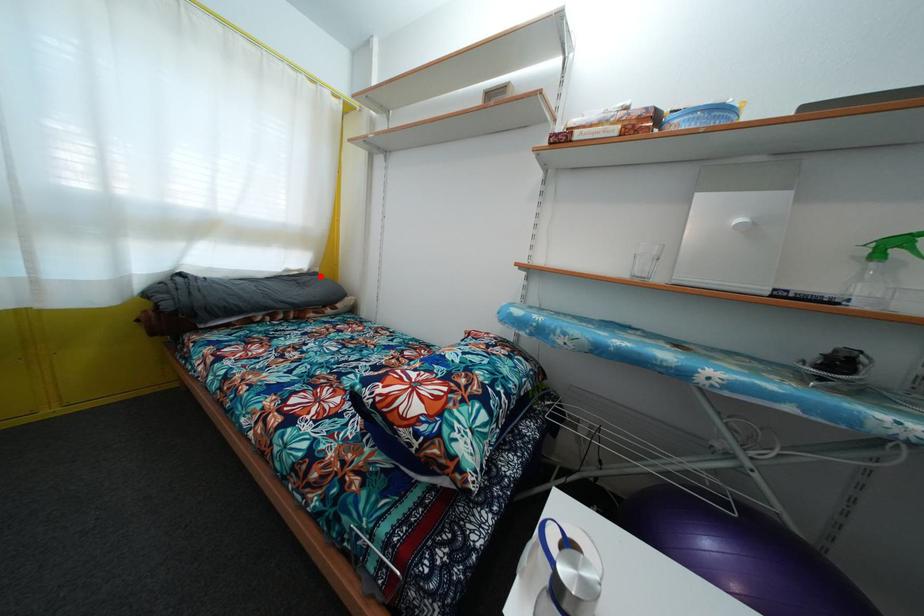
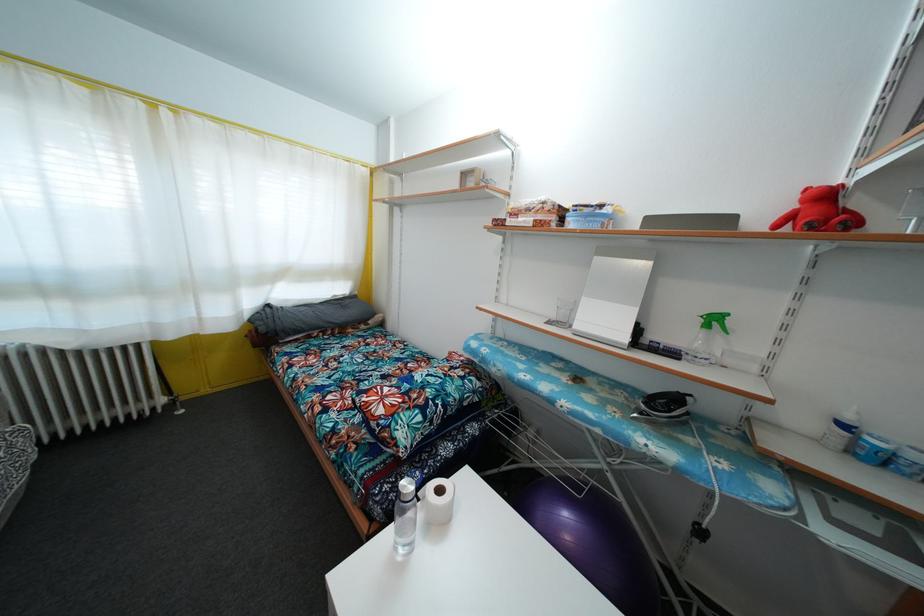
In the second image, find the point that corresponds to the highlighted location in the first image.

(359, 300)